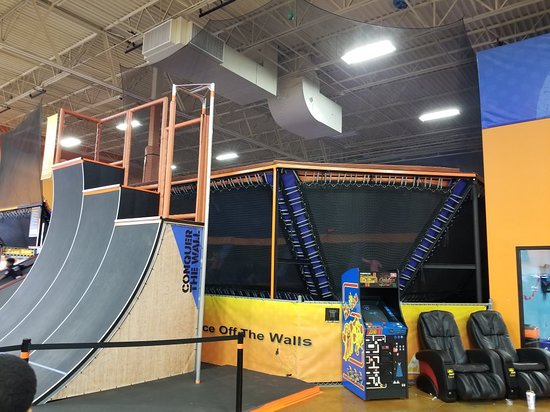
I want to click on cup, so click(x=531, y=398).